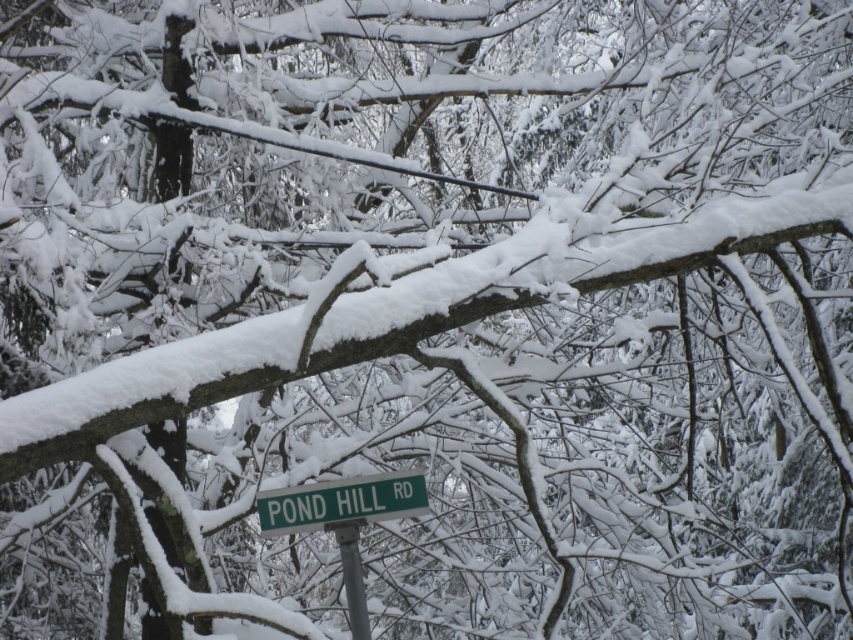
Question: Is green plastic street sign at center below metallic gray pole at center?

Choices:
 (A) no
 (B) yes

Answer: (A)

Question: From the image, what is the correct spatial relationship of green plastic street sign at center in relation to metallic gray pole at center?

Choices:
 (A) left
 (B) right

Answer: (A)

Question: Can you confirm if green plastic street sign at center is bigger than metallic gray pole at center?

Choices:
 (A) yes
 (B) no

Answer: (A)